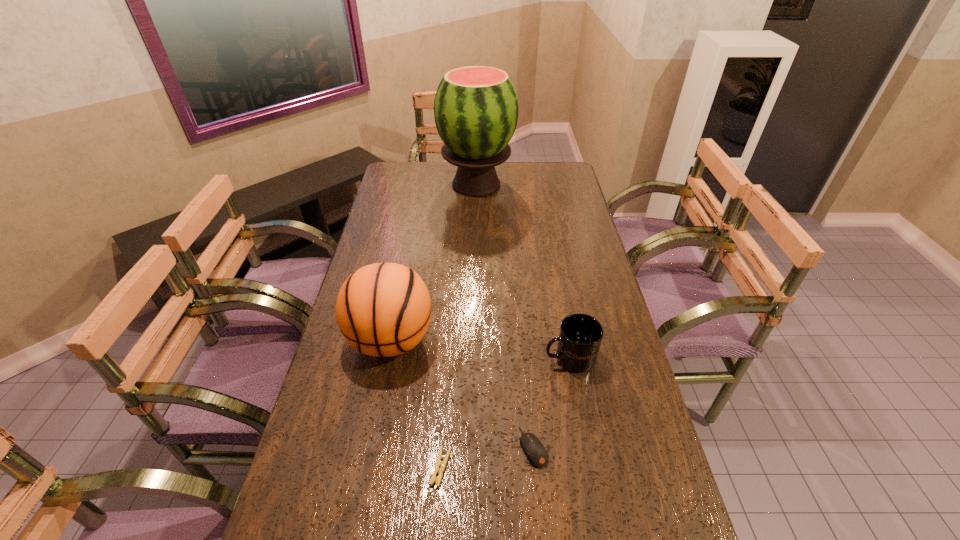
The height and width of the screenshot is (540, 960). In the image, there is a desktop. What are the coordinates of `vacant space at the far right corner` in the screenshot? It's located at (538, 164).

This screenshot has height=540, width=960. I want to click on free space between the fourth shortest object and the computer mouse, so click(462, 394).

The height and width of the screenshot is (540, 960). What are the coordinates of `free spot between the watermelon and the mug` in the screenshot? It's located at (523, 271).

What are the coordinates of `vacant space that is in between the rightmost object and the computer mouse` in the screenshot? It's located at (551, 402).

Where is `free spot between the fourth tallest object and the tallest object`? The height and width of the screenshot is (540, 960). free spot between the fourth tallest object and the tallest object is located at coordinates (505, 316).

What are the coordinates of `free space between the basketball and the tallest object` in the screenshot? It's located at (434, 262).

This screenshot has width=960, height=540. In order to click on vacant area that lies between the clothespin and the rightmost object in this screenshot , I will do `click(505, 412)`.

At what (x,y) coordinates should I click in order to perform the action: click on free spot between the third shortest object and the second shortest object. Please return your answer as a coordinate pair (x, y). The width and height of the screenshot is (960, 540). Looking at the image, I should click on (551, 402).

The image size is (960, 540). I want to click on free space between the watermelon and the basketball, so click(x=434, y=262).

Where is `vacant space that's between the tallest object and the clothespin`? This screenshot has width=960, height=540. vacant space that's between the tallest object and the clothespin is located at coordinates (459, 326).